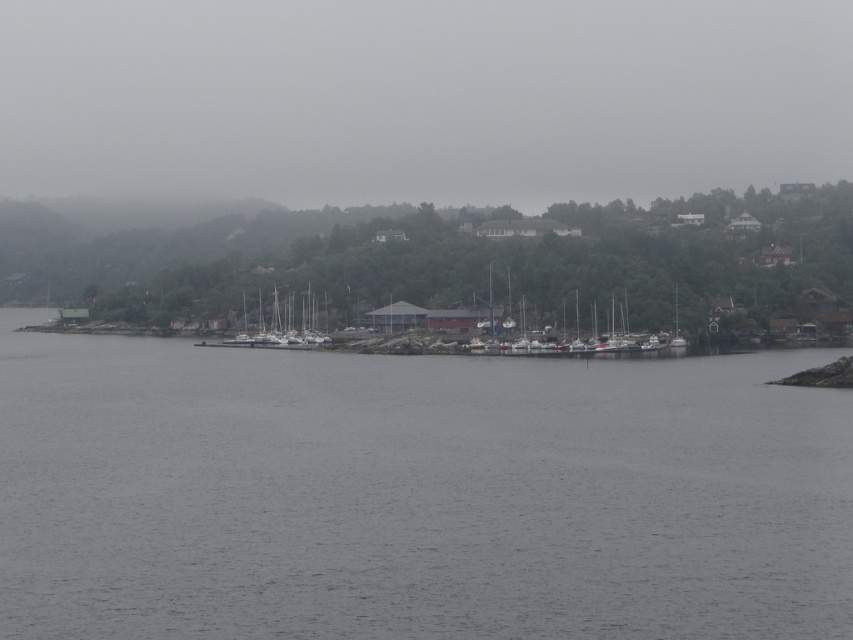
Can you confirm if white matte boats at center is wider than metallic gray boats at center?

Indeed, white matte boats at center has a greater width compared to metallic gray boats at center.

This screenshot has height=640, width=853. What do you see at coordinates (582, 342) in the screenshot? I see `white matte boats at center` at bounding box center [582, 342].

This screenshot has width=853, height=640. Identify the location of white matte boats at center. (582, 342).

Can you confirm if gray water at center is positioned above white matte boats at center?

No.

Who is lower down, gray water at center or white matte boats at center?

gray water at center is below.

Locate an element on the screen. The image size is (853, 640). gray water at center is located at coordinates (415, 493).

Is gray water at center below metallic gray boats at center?

Correct, gray water at center is located below metallic gray boats at center.

The height and width of the screenshot is (640, 853). Identify the location of gray water at center. (415, 493).

Locate an element on the screen. The width and height of the screenshot is (853, 640). gray water at center is located at coordinates (415, 493).